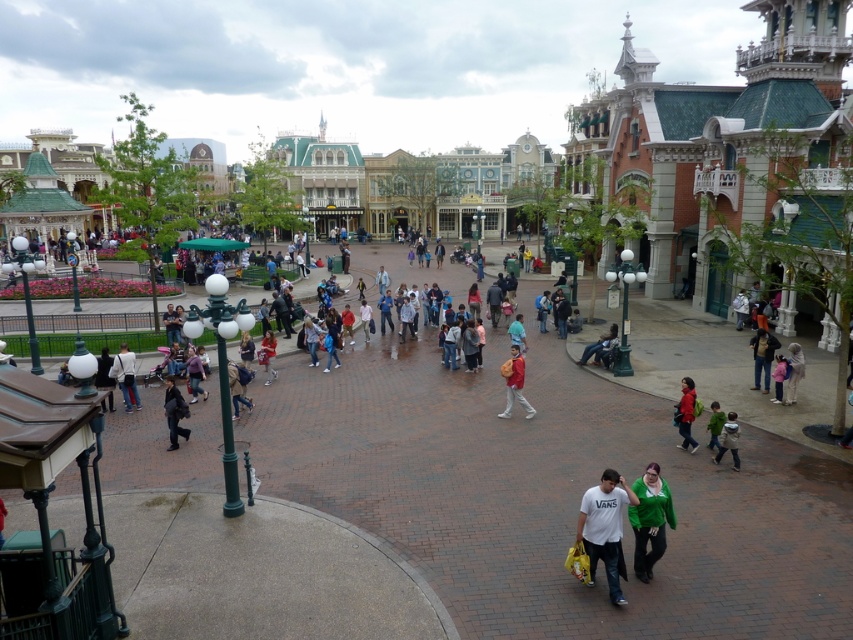
Can you confirm if white cotton t-shirt at center is positioned to the right of green fabric jacket at lower center?

Incorrect, white cotton t-shirt at center is not on the right side of green fabric jacket at lower center.

This screenshot has width=853, height=640. What do you see at coordinates (604, 529) in the screenshot?
I see `white cotton t-shirt at center` at bounding box center [604, 529].

Locate an element on the screen. This screenshot has width=853, height=640. white cotton t-shirt at center is located at coordinates (604, 529).

Does point (788, 356) lie in front of point (233, 417)?

Yes, point (788, 356) is in front of point (233, 417).

Between light pink fabric at lower right and light brown leather backpack at lower left, which one has more height?

light brown leather backpack at lower left

Locate an element on the screen. light pink fabric at lower right is located at coordinates (793, 371).

The height and width of the screenshot is (640, 853). I want to click on light pink fabric at lower right, so click(x=793, y=371).

Is point (637, 566) behind point (132, 381)?

No, (637, 566) is in front of (132, 381).

Find the location of a particular element. green fabric jacket at lower center is located at coordinates (648, 518).

This screenshot has height=640, width=853. What do you see at coordinates (648, 518) in the screenshot?
I see `green fabric jacket at lower center` at bounding box center [648, 518].

Identify the location of green fabric jacket at lower center. (648, 518).